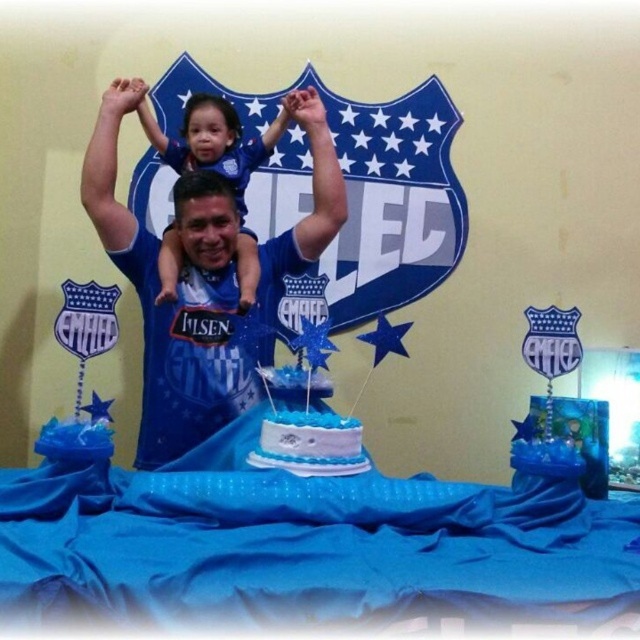
You are a photographer at the event and need to ensure both the matte blue shirt at center and the white frosted cake at center are visible in the frame. Which object should you position closer to the camera to avoid cropping either?

Since the matte blue shirt at center is wider than the white frosted cake at center, you should position the matte blue shirt at center closer to the camera to ensure its full width is captured without cropping.

You are standing at the point marked as point (188, 436) and want to place a new object exactly halfway between them. What are the coordinates of the midpoint?

The coordinates of the midpoint between the two points are calculated by averaging their respective x and y coordinates. Since the distance between them is 2.23 meters, the midpoint would be at the coordinates obtained by averaging their positions. However, without the exact coordinates of both points, we cannot provide numerical values for the midpoint.

You are a photographer at the event and need to position a camera to capture the blue jersey at center. According to the coordinates provided, where should the camera be placed relative to the scene?

The blue jersey at center is located at coordinates point (x=177, y=294), so the camera should be positioned to focus on that point to capture the blue jersey at center.